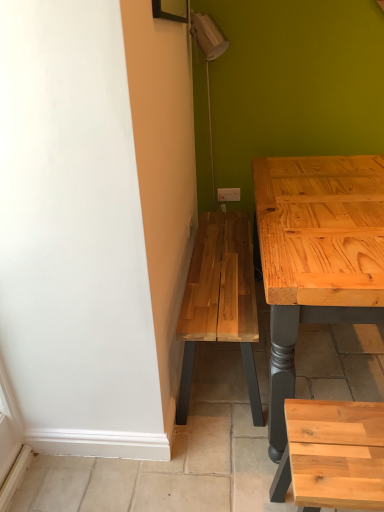
What do you see at coordinates (228, 194) in the screenshot? I see `white plastic electric outlet at upper center` at bounding box center [228, 194].

Measure the distance between white plastic electric outlet at upper center and camera.

The distance of white plastic electric outlet at upper center from camera is 8.71 feet.

I want to click on white plastic electric outlet at upper center, so click(x=228, y=194).

In order to face natural wood stool at lower right, should I rotate leftwards or rightwards?

You should look right and rotate roughly 19.895 degrees.

This screenshot has width=384, height=512. Describe the element at coordinates (336, 453) in the screenshot. I see `natural wood stool at lower right` at that location.

Identify the location of natural wood stool at lower right. The height and width of the screenshot is (512, 384). (336, 453).

This screenshot has width=384, height=512. I want to click on white plastic electric outlet at upper center, so click(228, 194).

Between white plastic electric outlet at upper center and natural wood stool at lower right, which one appears on the right side from the viewer's perspective?

natural wood stool at lower right.

Does white plastic electric outlet at upper center come behind natural wood stool at lower right?

Yes, white plastic electric outlet at upper center is further from the camera.

Which is closer to the camera, (x=236, y=190) or (x=294, y=432)?

The point (x=294, y=432) is in front.

Consider the image. From the image's perspective, between white plastic electric outlet at upper center and natural wood stool at lower right, which one is located above?

From the image's view, white plastic electric outlet at upper center is above.

From a real-world perspective, is white plastic electric outlet at upper center physically above natural wood stool at lower right?

Yes, from a real-world perspective, white plastic electric outlet at upper center is on top of natural wood stool at lower right.

Is white plastic electric outlet at upper center wider or thinner than natural wood stool at lower right?

white plastic electric outlet at upper center is thinner than natural wood stool at lower right.

Looking at this image, is white plastic electric outlet at upper center shorter than natural wood stool at lower right?

Yes.

Considering the sizes of objects white plastic electric outlet at upper center and natural wood stool at lower right in the image provided, who is bigger, white plastic electric outlet at upper center or natural wood stool at lower right?

natural wood stool at lower right is bigger.

Would you say white plastic electric outlet at upper center contains natural wood stool at lower right?

That's incorrect, natural wood stool at lower right is not inside white plastic electric outlet at upper center.

Does white plastic electric outlet at upper center touch natural wood stool at lower right?

There is a gap between white plastic electric outlet at upper center and natural wood stool at lower right.

Does white plastic electric outlet at upper center turn towards natural wood stool at lower right?

Yes, white plastic electric outlet at upper center faces towards natural wood stool at lower right.

How much distance is there between white plastic electric outlet at upper center and natural wood stool at lower right?

white plastic electric outlet at upper center and natural wood stool at lower right are 5.93 feet apart from each other.

The image size is (384, 512). I want to click on electric outlet lying above the natural wood stool at lower right (from the image's perspective), so click(228, 194).

Between natural wood stool at lower right and white plastic electric outlet at upper center, which one appears on the right side from the viewer's perspective?

natural wood stool at lower right.

Is natural wood stool at lower right closer to camera compared to white plastic electric outlet at upper center?

Yes, natural wood stool at lower right is closer to the viewer.

Considering the positions of point (353, 466) and point (231, 192), is point (353, 466) closer or farther from the camera than point (231, 192)?

Point (353, 466) is closer to the camera than point (231, 192).

From the image's perspective, who appears lower, natural wood stool at lower right or white plastic electric outlet at upper center?

natural wood stool at lower right, from the image's perspective.

From a real-world perspective, which is physically above, natural wood stool at lower right or white plastic electric outlet at upper center?

From a 3D spatial view, white plastic electric outlet at upper center is above.

Looking at their sizes, would you say natural wood stool at lower right is wider or thinner than white plastic electric outlet at upper center?

Considering their sizes, natural wood stool at lower right looks broader than white plastic electric outlet at upper center.

In the scene shown: Considering the relative sizes of natural wood stool at lower right and white plastic electric outlet at upper center in the image provided, is natural wood stool at lower right taller than white plastic electric outlet at upper center?

Yes, natural wood stool at lower right is taller than white plastic electric outlet at upper center.

Considering the sizes of natural wood stool at lower right and white plastic electric outlet at upper center in the image, is natural wood stool at lower right bigger or smaller than white plastic electric outlet at upper center?

natural wood stool at lower right is bigger than white plastic electric outlet at upper center.

Can we say natural wood stool at lower right lies outside white plastic electric outlet at upper center?

Yes, natural wood stool at lower right is located beyond the bounds of white plastic electric outlet at upper center.

Based on the photo, is natural wood stool at lower right with white plastic electric outlet at upper center?

No, natural wood stool at lower right is not making contact with white plastic electric outlet at upper center.

Is natural wood stool at lower right facing towards white plastic electric outlet at upper center?

No, natural wood stool at lower right is not oriented towards white plastic electric outlet at upper center.

How different are the orientations of natural wood stool at lower right and white plastic electric outlet at upper center in degrees?

There is a 2.44-degree angle between the facing directions of natural wood stool at lower right and white plastic electric outlet at upper center.

Find the location of a particular element. The height and width of the screenshot is (512, 384). electric outlet that is above the natural wood stool at lower right (from a real-world perspective) is located at coordinates (228, 194).

The height and width of the screenshot is (512, 384). Identify the location of stool below the white plastic electric outlet at upper center (from the image's perspective). (336, 453).

Where is `electric outlet to the left of natural wood stool at lower right`? The height and width of the screenshot is (512, 384). electric outlet to the left of natural wood stool at lower right is located at coordinates (228, 194).